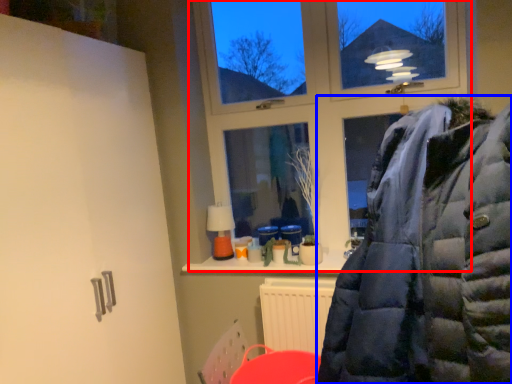
Question: Among these objects, which one is farthest to the camera, window (highlighted by a red box) or jacket (highlighted by a blue box)?

Choices:
 (A) window
 (B) jacket

Answer: (A)